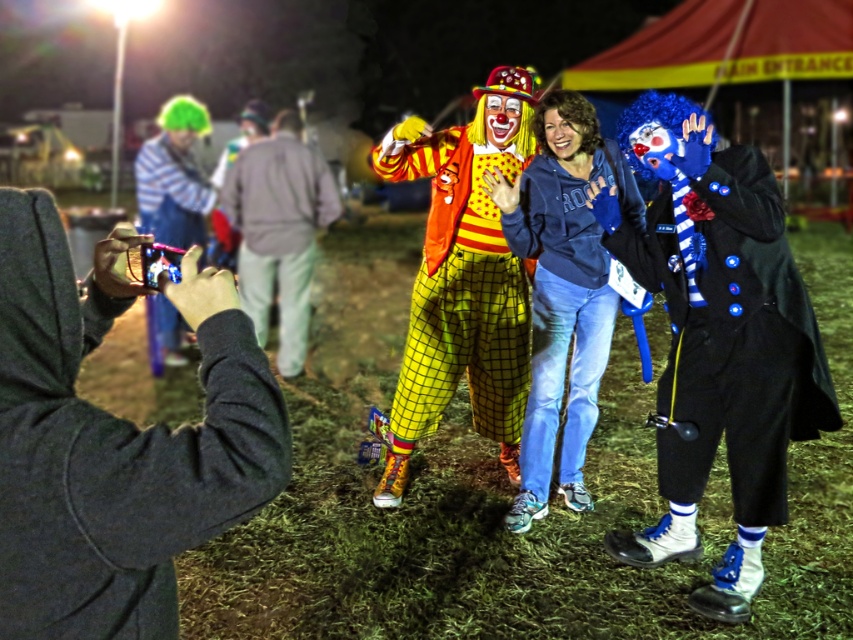
Who is shorter, velvet blue coat at center or matte blue scarf at center?

With less height is matte blue scarf at center.

Which is below, velvet blue coat at center or matte blue scarf at center?

Positioned lower is velvet blue coat at center.

Who is more distant from viewer, (631, 243) or (579, 131)?

Point (579, 131)

Image resolution: width=853 pixels, height=640 pixels. I want to click on velvet blue coat at center, so click(x=734, y=339).

Is blue cotton hoodie at center below light gray sweatshirt at center?

Yes, blue cotton hoodie at center is below light gray sweatshirt at center.

Which is above, blue cotton hoodie at center or light gray sweatshirt at center?

light gray sweatshirt at center is above.

What do you see at coordinates (561, 300) in the screenshot?
I see `blue cotton hoodie at center` at bounding box center [561, 300].

The width and height of the screenshot is (853, 640). In order to click on blue cotton hoodie at center in this screenshot , I will do `click(561, 300)`.

Can you confirm if green plastic helmet at left is smaller than matte clown face at center?

No.

Who is more forward, (143, 186) or (506, 138)?

Positioned in front is point (506, 138).

Where is `green plastic helmet at left`? The height and width of the screenshot is (640, 853). green plastic helmet at left is located at coordinates (173, 177).